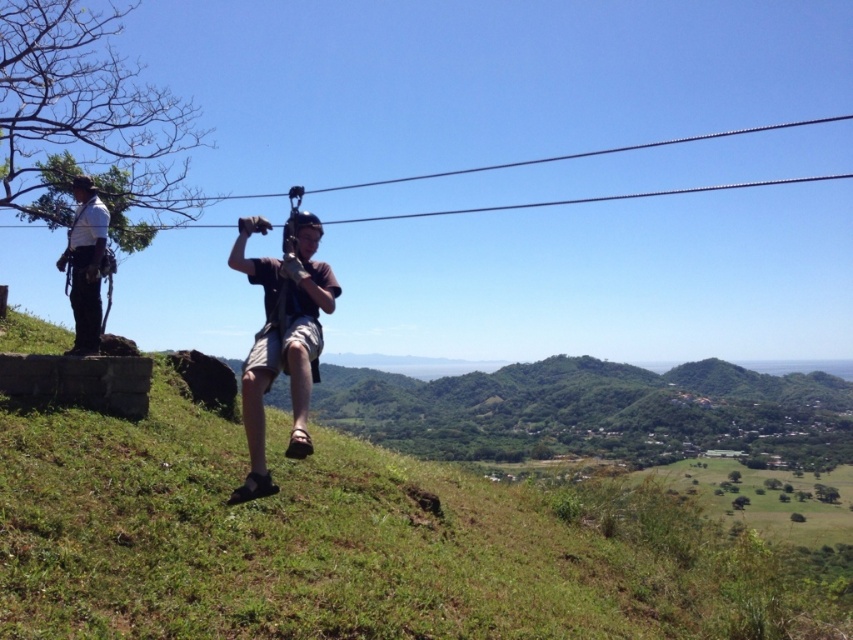
Describe the element at coordinates (281, 339) in the screenshot. I see `brown fabric shorts at center` at that location.

Which is below, brown fabric shorts at center or white shirt with harness at left?

Positioned lower is brown fabric shorts at center.

The width and height of the screenshot is (853, 640). What do you see at coordinates (281, 339) in the screenshot?
I see `brown fabric shorts at center` at bounding box center [281, 339].

In order to click on brown fabric shorts at center in this screenshot , I will do `click(281, 339)`.

What do you see at coordinates (349, 541) in the screenshot? I see `green grassy hillside at center` at bounding box center [349, 541].

Is green grassy hillside at center above brown fabric shorts at center?

No.

Does point (195, 481) come behind point (326, 292)?

Yes.

The width and height of the screenshot is (853, 640). What are the coordinates of `green grassy hillside at center` in the screenshot? It's located at (349, 541).

Is point (402, 531) closer to viewer compared to point (94, 352)?

Yes, it is.

How distant is green grassy hillside at center from white shirt with harness at left?

green grassy hillside at center and white shirt with harness at left are 4.55 meters apart.

Who is more forward, [573,545] or [86,333]?

Point [86,333] is more forward.

At what (x,y) coordinates should I click in order to perform the action: click on green grassy hillside at center. Please return your answer as a coordinate pair (x, y). Image resolution: width=853 pixels, height=640 pixels. Looking at the image, I should click on (349, 541).